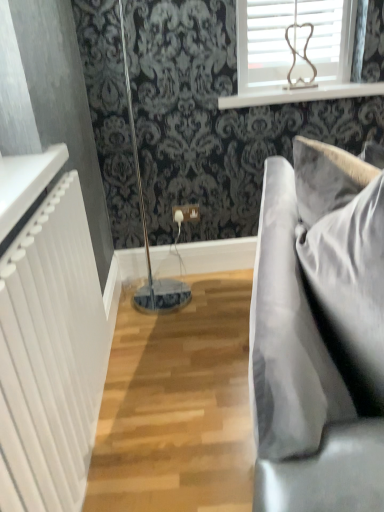
The image size is (384, 512). I want to click on vacant area on top of white textured radiator at left (from a real-world perspective), so click(x=39, y=210).